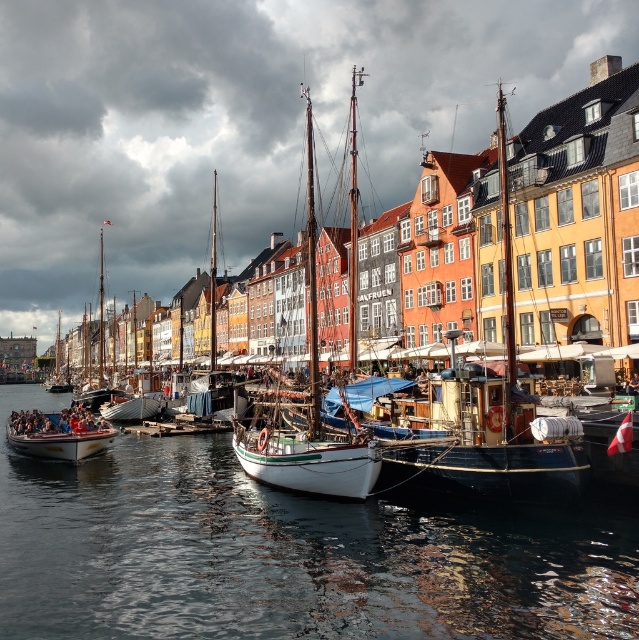
You are a photographer positioned at the waterfront, aiming to capture a clear shot of the wooden sailboat at center and the white matte sailboat at center. Based on their positions, which boat will appear closer to the camera in your photo?

The wooden sailboat at center will appear closer to the camera because it is positioned in front of the white matte sailboat at center.

You are standing at the waterfront and want to take a photo of the point at coordinates point (x=390, y=65). If your camera has a maximum focus range of 500 meters, will you be able to capture it clearly?

The distance of point (x=390, y=65) from viewer is 499.08 meters, which is within the camera maximum focus range of 500 meters. Yes, you can capture it clearly.

You are standing at the waterfront and want to take a photo that includes both the point at coordinates point (344, 486) and point (66, 444). Which point will appear larger in your photo?

Point (344, 486) will appear larger in the photo because it is closer to the camera than point (66, 444).